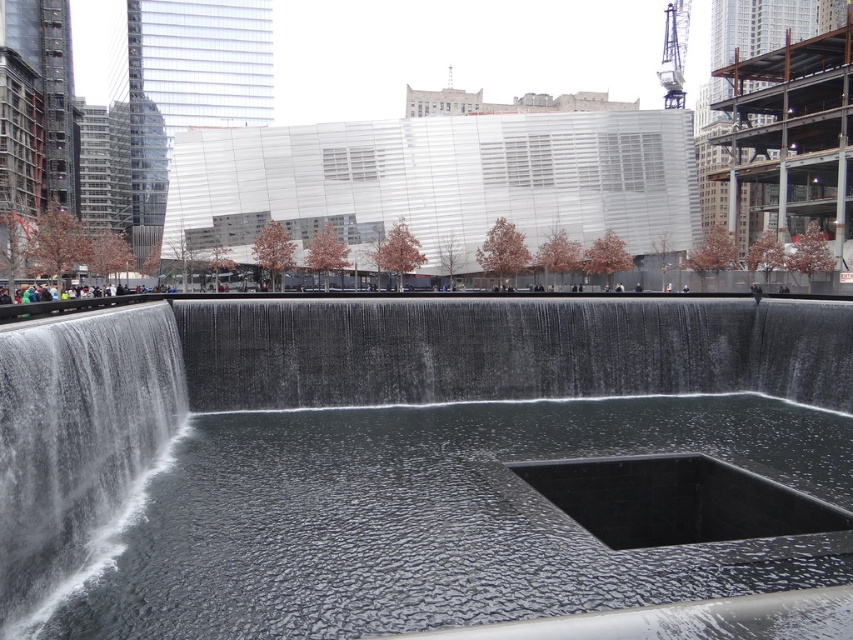
You are a landscape architect designing a new pathway between the black polished water at center and the clear water at center. The pathway must be 5 meters long. Can the pathway fit between them without needing to extend beyond their current positions?

The black polished water at center and clear water at center are 5.41 meters apart from each other. Since the required pathway is 5 meters long, which is shorter than the distance between them, the pathway can fit between them without needing to extend beyond their current positions.

You are designing a layout for a promotional brochure and need to know the relative sizes of the water features. Which water feature, the black polished water at center or the white textured water at left, has a greater width?

The black polished water at center has a greater width than the white textured water at left according to the description.